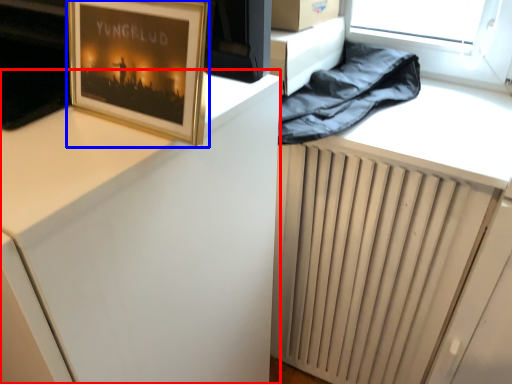
Question: Which object appears closest to the camera in this image, computer desk (highlighted by a red box) or picture frame (highlighted by a blue box)?

Choices:
 (A) computer desk
 (B) picture frame

Answer: (A)